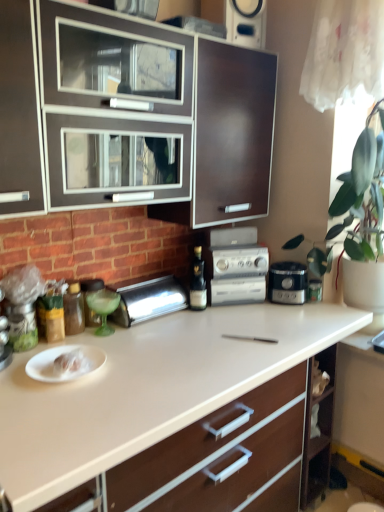
I want to click on free space between black glass bottle at center, which is the first bottle from back to front, and white paper plate at lower left, so click(x=160, y=328).